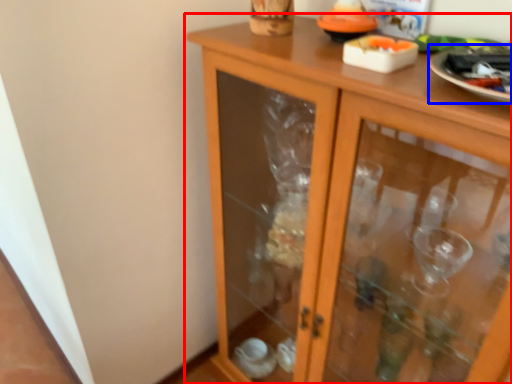
Question: Which of the following is the farthest to the observer, cupboard (highlighted by a red box) or glass plate (highlighted by a blue box)?

Choices:
 (A) cupboard
 (B) glass plate

Answer: (B)